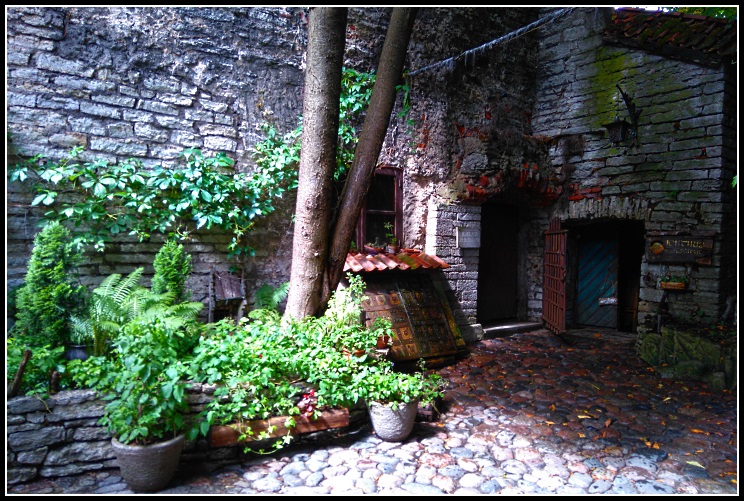
Identify the location of 1 window. Image resolution: width=744 pixels, height=501 pixels. (385, 215).